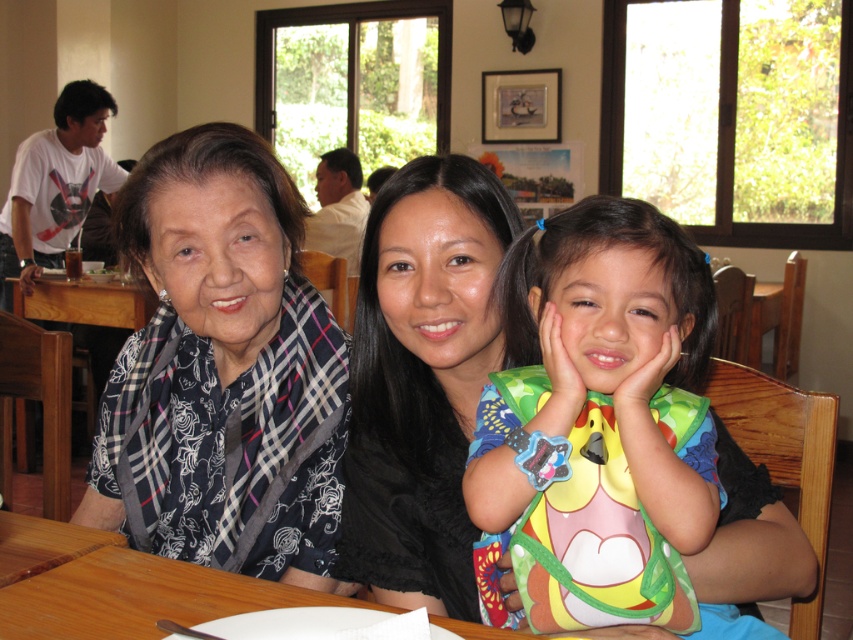
What is the position of the plaid fabric shawl at left in the image?

The plaid fabric shawl at left is located at point (238, 355).